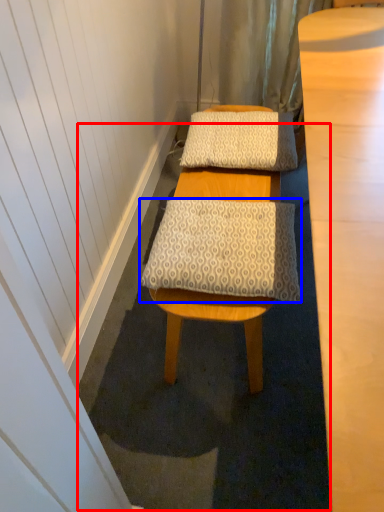
Question: Which point is further to the camera, bath mat (highlighted by a red box) or pillow (highlighted by a blue box)?

Choices:
 (A) bath mat
 (B) pillow

Answer: (A)